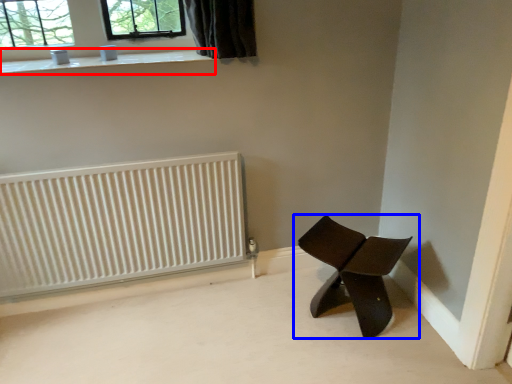
Question: Which object is further to the camera taking this photo, window sill (highlighted by a red box) or chair (highlighted by a blue box)?

Choices:
 (A) window sill
 (B) chair

Answer: (A)